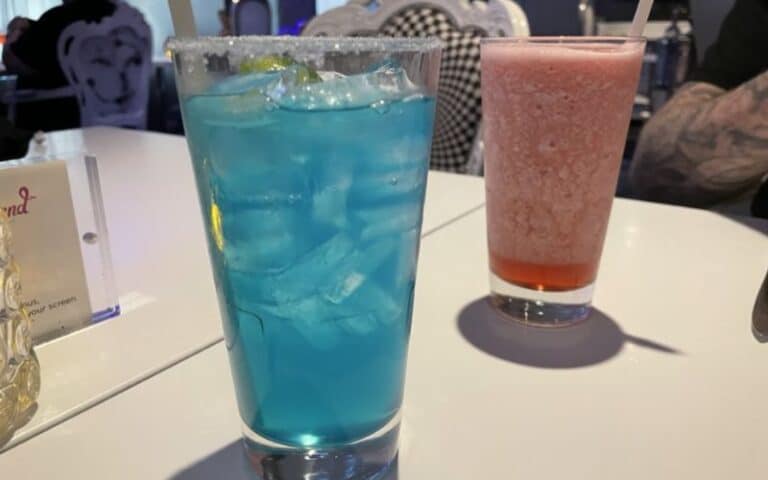
Identify the location of clear glass bases. This screenshot has width=768, height=480. (382, 441), (531, 292).